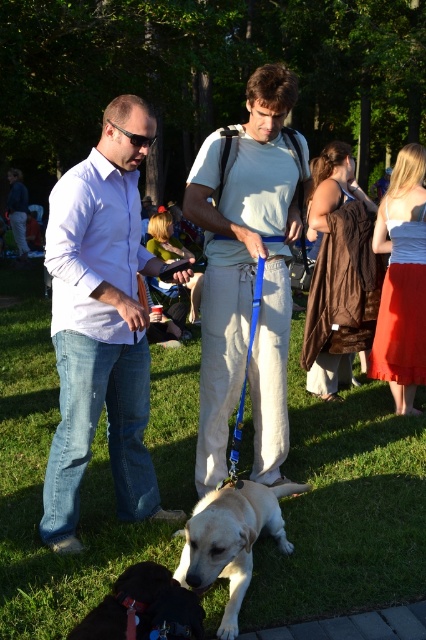
Based on the photo, you are a photographer taking a picture of the scene. You notice the green grass at center and the matte orange skirt at right. Which object should you focus on first to ensure both are in focus?

You should focus on the matte orange skirt at right first because it is farther away from the viewer than the green grass at center, ensuring both will be in focus when using depth of field techniques.

You are planning to place a small table between the green grass at center and the brown suede dress at center. The table requires at least 4 feet of space to fit comfortably. Based on the scene description, will there be enough space?

The green grass at center and brown suede dress at center are 3.91 feet apart, which is slightly less than the required 4 feet. Therefore, there isn not enough space to place the table comfortably between them.